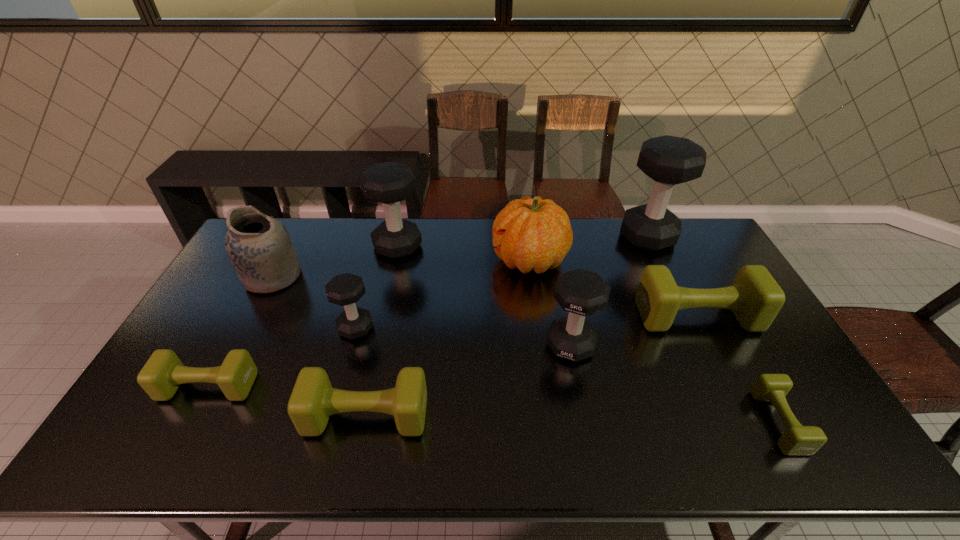
The width and height of the screenshot is (960, 540). I want to click on vacant space that's between the eighth tallest object and the tallest object, so click(x=507, y=326).

Where is `free space between the pumpkin and the shortest object`? Image resolution: width=960 pixels, height=540 pixels. free space between the pumpkin and the shortest object is located at coordinates tap(654, 341).

At what (x,y) coordinates should I click in order to perform the action: click on unoccupied area between the third shortest dumbbell and the shortest object. Please return your answer as a coordinate pair (x, y). Looking at the image, I should click on (572, 418).

I want to click on empty location between the smallest gray dumbbell and the smallest olive dumbbell, so click(567, 375).

Where is `free spot between the tallest object and the leftmost dumbbell`? This screenshot has height=540, width=960. free spot between the tallest object and the leftmost dumbbell is located at coordinates (428, 312).

The height and width of the screenshot is (540, 960). I want to click on vacant space that is in between the third olive dumbbell from right to left and the shortest dumbbell, so click(572, 418).

You are a GUI agent. You are given a task and a screenshot of the screen. Output one action in this format:
    pyautogui.click(x=<x>, y=<y>)
    Task: Click on the unoccupied position between the smallest gray dumbbell and the pottery
    
    Given the screenshot: What is the action you would take?
    pyautogui.click(x=314, y=302)

Locate an element on the screen. object that is the fourth closest one to the third tallest dumbbell is located at coordinates (797, 440).

This screenshot has height=540, width=960. Identify the location of the eighth closest object to the orange pumpkin. (259, 247).

You are a GUI agent. You are given a task and a screenshot of the screen. Output one action in this format:
    pyautogui.click(x=<x>, y=<y>)
    Task: Click on the dumbbell that is the third nearest to the seventh tallest object
    
    Given the screenshot: What is the action you would take?
    pyautogui.click(x=668, y=160)